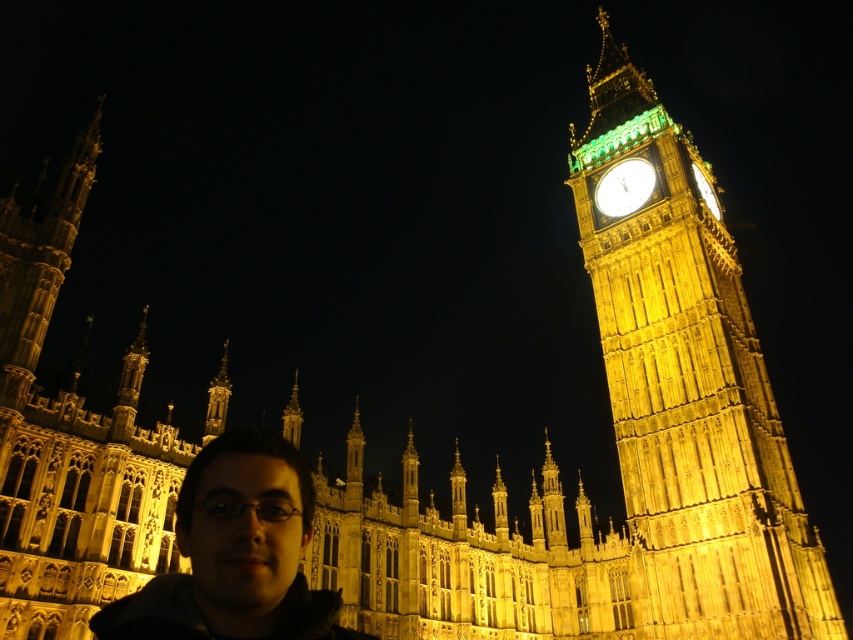
You are a tourist standing in front of Big Ben at night. You notice a specific point marked at coordinates point (x=235, y=552). Based on the scene description, can you determine what object this point is located on?

The point (x=235, y=552) is located on the matte black jacket at lower left.

You are a tourist standing at the base of the golden stone clock tower at right. You want to take a photo that includes both yourself and the entire tower in the frame. Considering your camera has a maximum zoom range of 100 meters, can you capture the tower and yourself in the same photo without moving?

The distance between the golden stone clock tower at right and the camera is 57.86 meters. Since the camera can zoom up to 100 meters, you can capture both yourself and the entire tower in the same photo without moving.

You are standing in front of Big Ben at night and see two points marked on the tower. The first point is at coordinates point (91, 627) and the second is at point (601, 196). If you want to touch the closest point to you on the tower, which one should you aim for?

You should aim for point (91, 627) because it is closer to the viewer than point (601, 196).